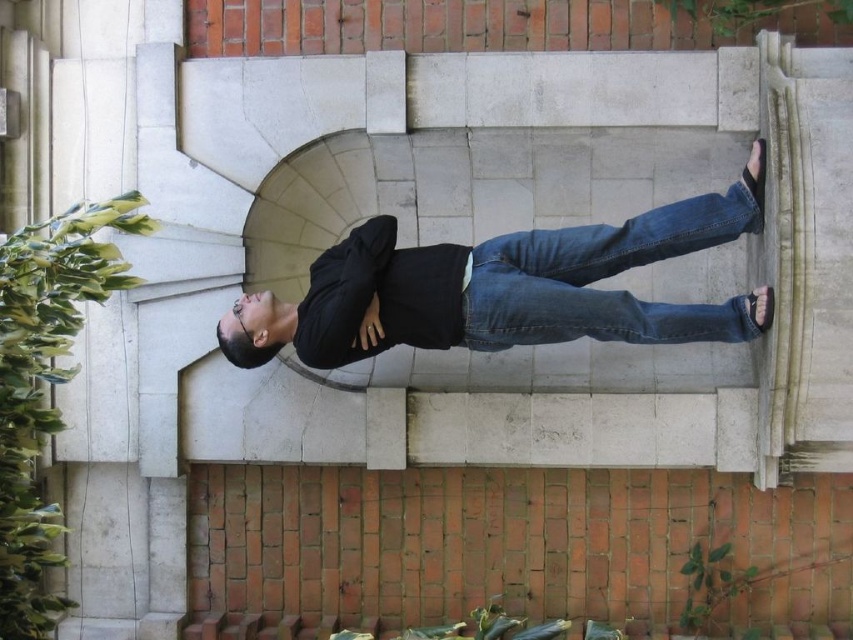
Question: Is black matte shirt at center positioned before denim at center?

Choices:
 (A) yes
 (B) no

Answer: (A)

Question: Which object is closer to the camera taking this photo?

Choices:
 (A) denim at center
 (B) black matte shirt at center

Answer: (B)

Question: Which of the following is the farthest from the observer?

Choices:
 (A) denim at center
 (B) black matte shirt at center

Answer: (A)

Question: Can you confirm if black matte shirt at center is positioned to the right of denim at center?

Choices:
 (A) yes
 (B) no

Answer: (B)

Question: Does black matte shirt at center have a lesser width compared to denim at center?

Choices:
 (A) yes
 (B) no

Answer: (B)

Question: Among these points, which one is farthest from the camera?

Choices:
 (A) (651, 234)
 (B) (434, 257)

Answer: (B)